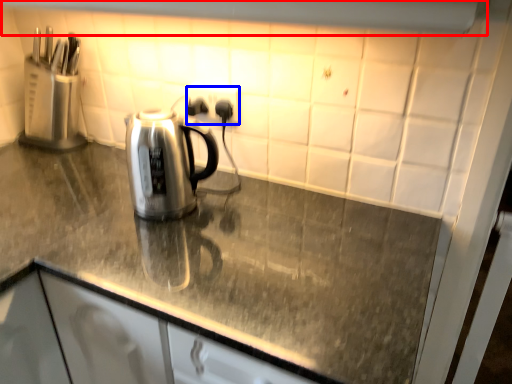
Question: Among these objects, which one is farthest to the camera, exhaust hood (highlighted by a red box) or electric outlet (highlighted by a blue box)?

Choices:
 (A) exhaust hood
 (B) electric outlet

Answer: (B)